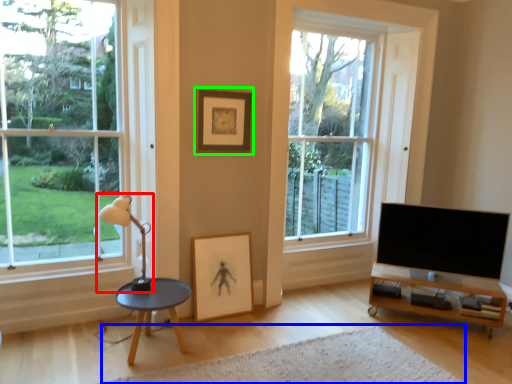
Question: Which object is the farthest from lamp (highlighted by a red box)? Choose among these: plain (highlighted by a blue box) or picture frame (highlighted by a green box).

Choices:
 (A) plain
 (B) picture frame

Answer: (A)